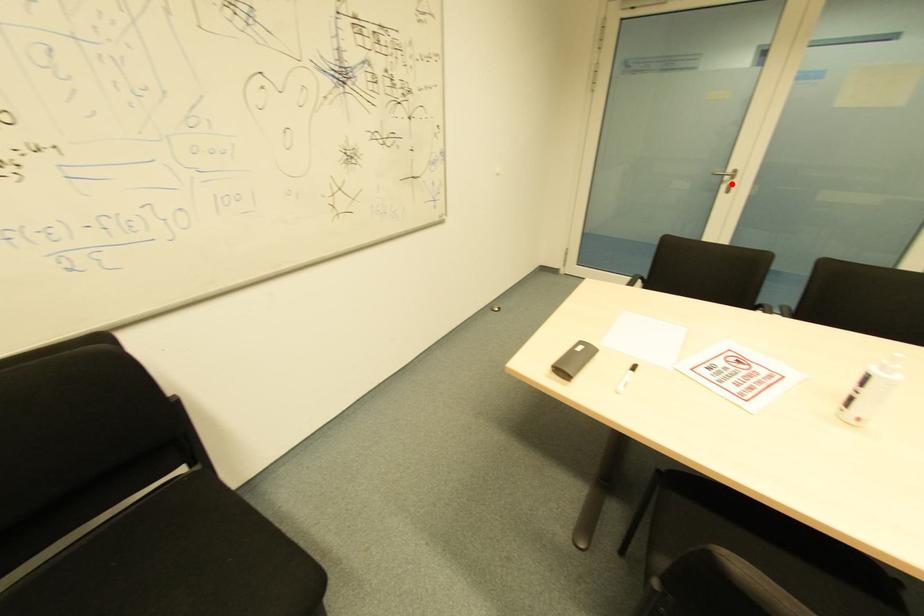
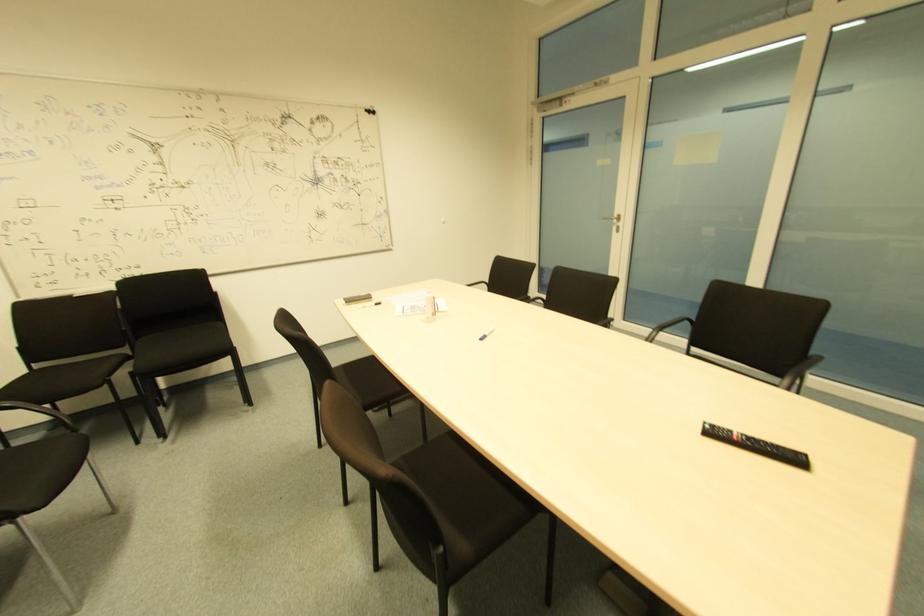
Find the pixel in the second image that matches the highlighted location in the first image.

(618, 227)